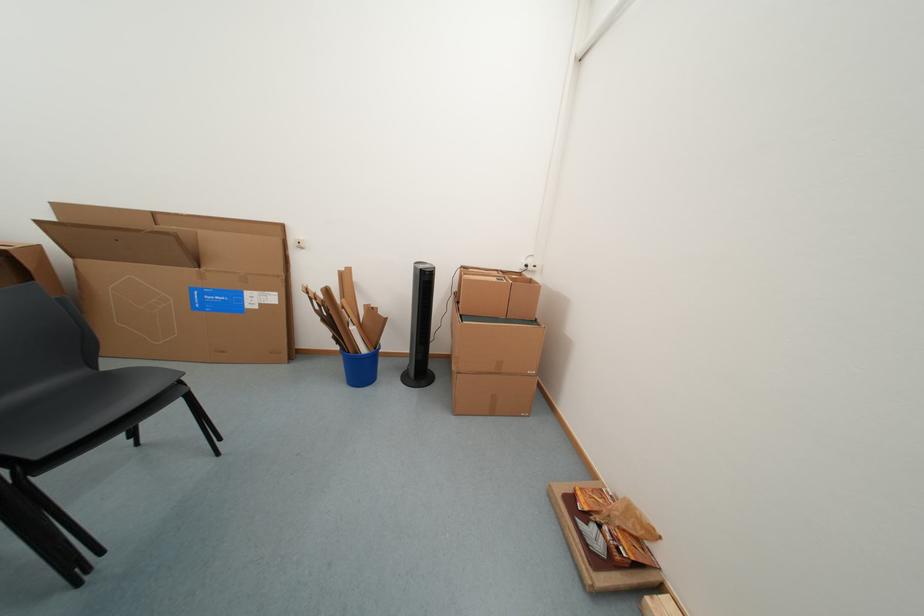
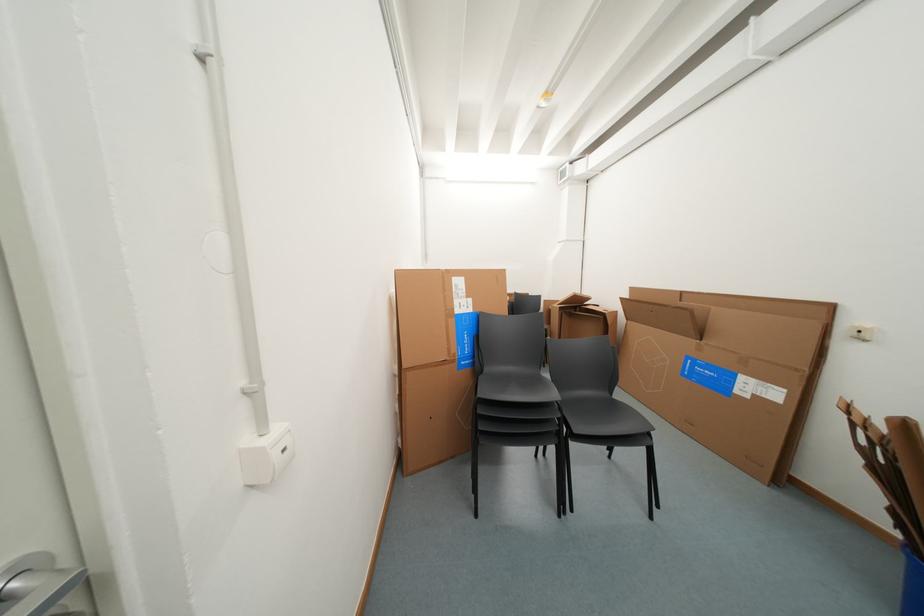
Question: The camera is either moving clockwise (left) or counter-clockwise (right) around the object. The first image is from the beginning of the video and the second image is from the end. Is the camera moving left or right when shooting the video?

Choices:
 (A) Left
 (B) Right

Answer: (B)